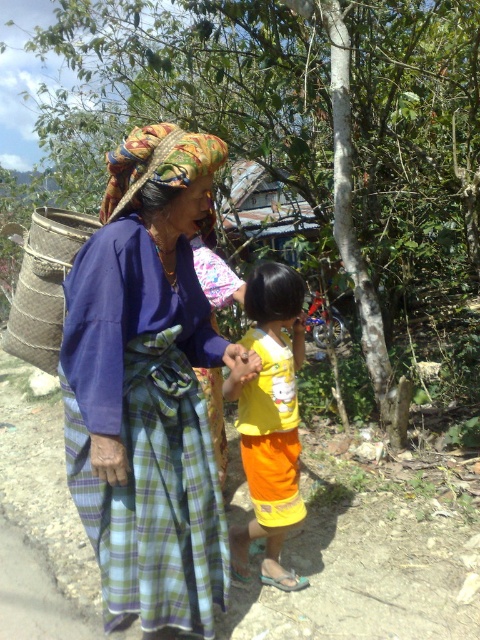
You are a photographer trying to capture a candid shot of the yellow matte shirt at center and the natural woven basket at left. Since you want both subjects to be in focus, you need to know which one is wider. Can you determine which is wider?

The yellow matte shirt at center is less wide than the natural woven basket at left, so the photographer should focus on the natural woven basket at left as it is wider.

You are a photographer trying to capture the grandmother and grandchild walking along the path. You want to ensure the plaid fabric headscarf at center and the yellow matte shirt at center are both visible in the frame. Based on their positions, which one should you focus on first to ensure both are in the shot?

The plaid fabric headscarf at center is above the yellow matte shirt at center, so focusing on the plaid fabric headscarf at center first will ensure both are visible in the frame.

You are an observer standing on the dirt path. You see the plaid fabric headscarf at center and the yellow matte shirt at center. Which object is wider?

The plaid fabric headscarf at center is wider than the yellow matte shirt at center according to the description.